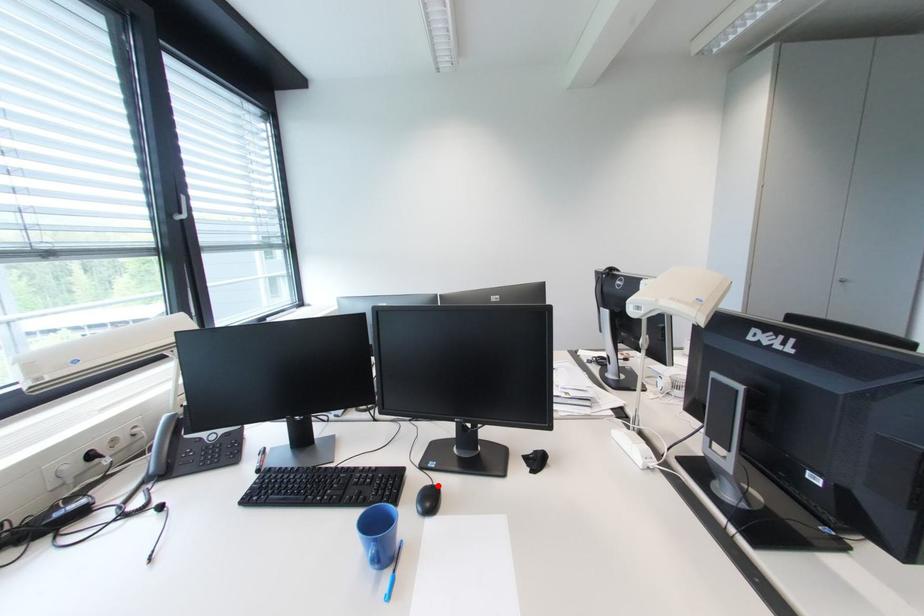
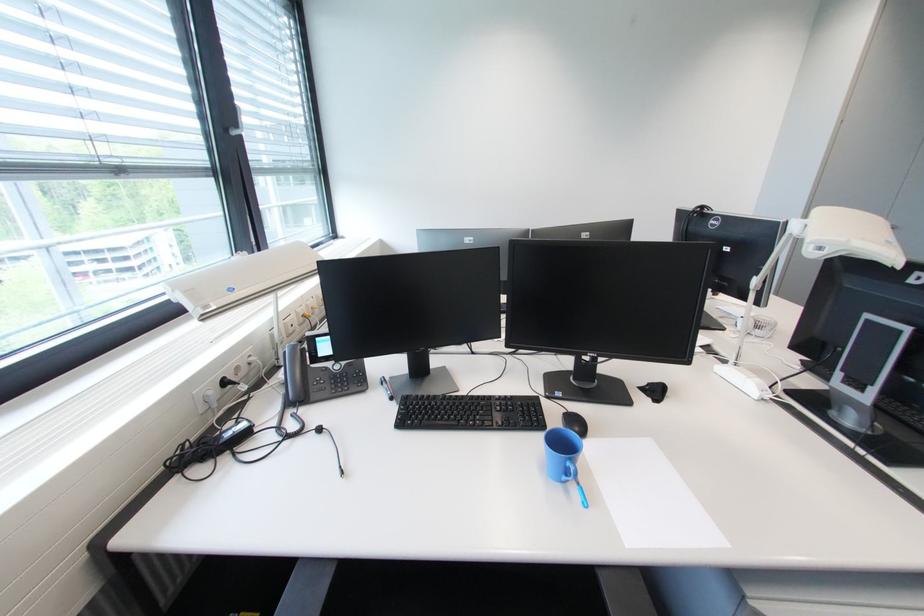
In the second image, find the point that corresponds to the highlighted location in the first image.

(573, 411)